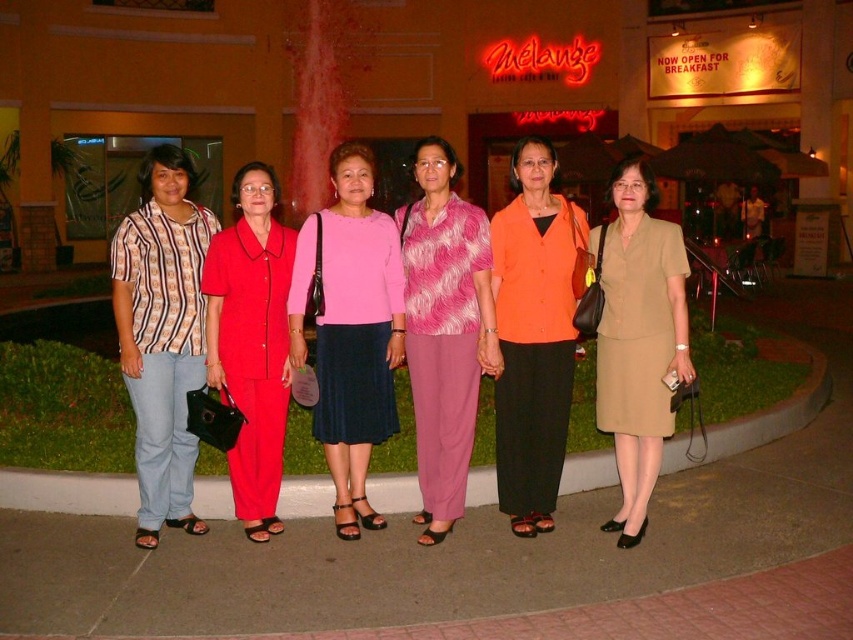
Is orange matte shirt at center smaller than pink fuzzy sweater at center?

Yes, orange matte shirt at center is smaller than pink fuzzy sweater at center.

Can you confirm if orange matte shirt at center is positioned above pink fuzzy sweater at center?

Yes.

You are a GUI agent. You are given a task and a screenshot of the screen. Output one action in this format:
    pyautogui.click(x=<x>, y=<y>)
    Task: Click on the orange matte shirt at center
    The image size is (853, 640).
    Given the screenshot: What is the action you would take?
    pyautogui.click(x=532, y=336)

Does pink fabric skirt at center lie behind matte red suit at center?

Yes, it is behind matte red suit at center.

Between point (372, 525) and point (252, 362), which one is positioned in front?

Positioned in front is point (252, 362).

At what (x,y) coordinates should I click in order to perform the action: click on pink fabric skirt at center. Please return your answer as a coordinate pair (x, y). This screenshot has height=640, width=853. Looking at the image, I should click on (350, 330).

Who is more forward, (343, 384) or (419, 518)?

Positioned in front is point (343, 384).

Can you confirm if pink fabric skirt at center is shorter than pink fuzzy sweater at center?

Indeed, pink fabric skirt at center has a lesser height compared to pink fuzzy sweater at center.

Does point (354, 284) lie in front of point (450, 506)?

That is False.

Locate an element on the screen. The height and width of the screenshot is (640, 853). pink fabric skirt at center is located at coordinates (350, 330).